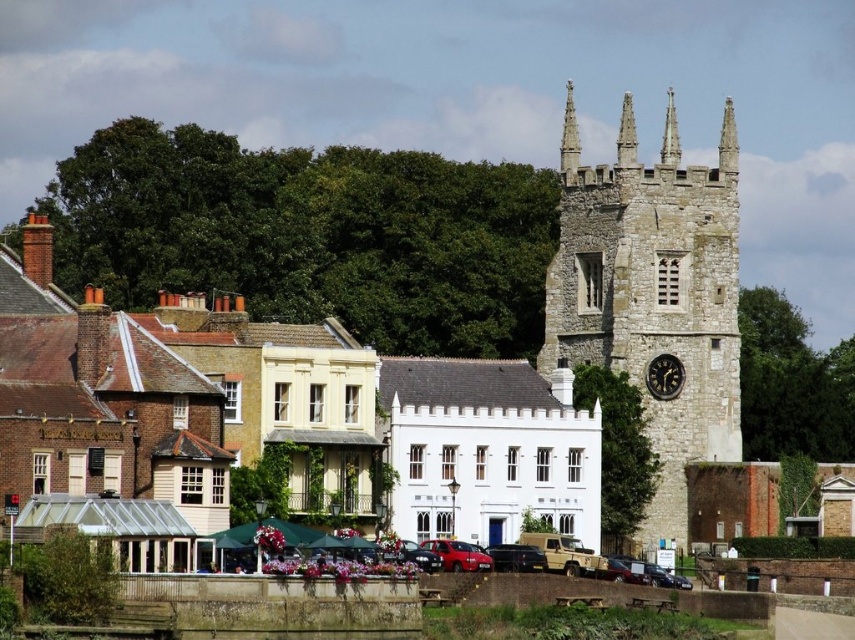
You are standing in the town square and want to take a photo of both the stone clock tower at center and the black stone clock at right. Which one should you focus on first to ensure both are in the frame?

You should focus on the stone clock tower at center first because it is closer to you than the black stone clock at right, so adjusting the camera to include both would require framing starting from the closer object.

You are a photographer planning to capture a wide shot of the town square. You notice the stone clock tower at center and the metallic red car at center. Which object would appear wider in your photo?

The stone clock tower at center appears wider in the photo because its width is larger than that of the metallic red car at center.

You are a tourist standing in the town square and see the metallic red car at center and the black stone clock at right. Which object is closer to the left side of the square?

The metallic red car at center is closer to the left side of the square because it is positioned to the left of the black stone clock at right.